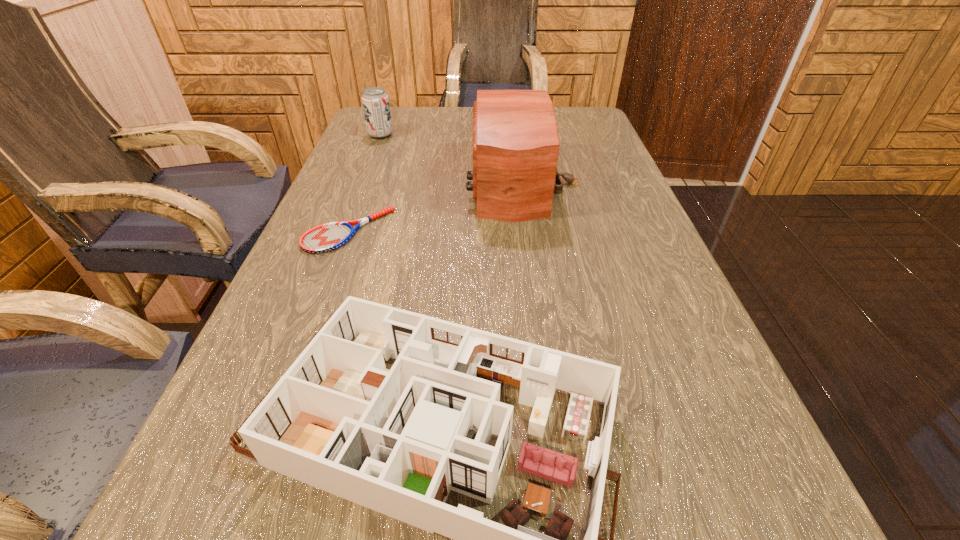
Where is `beer can present at the left edge`? This screenshot has width=960, height=540. beer can present at the left edge is located at coordinates (375, 101).

The width and height of the screenshot is (960, 540). What are the coordinates of `tennis racket positioned at the left edge` in the screenshot? It's located at pyautogui.click(x=327, y=237).

Identify the location of object that is at the right edge. The width and height of the screenshot is (960, 540). (515, 148).

This screenshot has height=540, width=960. What are the coordinates of `object at the far left corner` in the screenshot? It's located at (375, 101).

You are a GUI agent. You are given a task and a screenshot of the screen. Output one action in this format:
    pyautogui.click(x=<x>, y=<y>)
    Task: Click on the vacant space at the far edge of the desktop
    Image resolution: width=960 pixels, height=540 pixels.
    Given the screenshot: What is the action you would take?
    pyautogui.click(x=466, y=124)

Locate an element on the screen. The width and height of the screenshot is (960, 540). vacant space at the left edge of the desktop is located at coordinates (331, 186).

Locate an element on the screen. The image size is (960, 540). vacant space at the right edge is located at coordinates (647, 374).

Locate an element on the screen. vacant space at the far right corner of the desktop is located at coordinates (561, 108).

Find the location of a particular element. Image resolution: width=960 pixels, height=540 pixels. free point between the tallest object and the third shortest object is located at coordinates (452, 159).

Identify the location of free space between the radio receiver and the shortest object. The height and width of the screenshot is (540, 960). (436, 207).